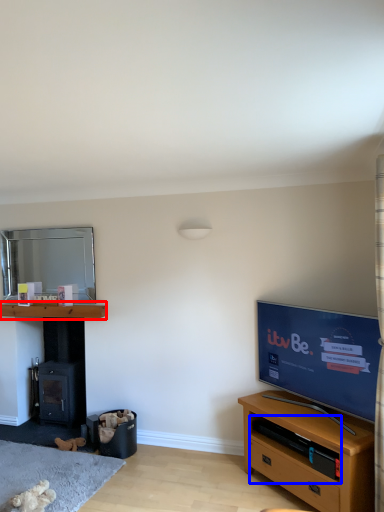
Question: Which point is further to the camera, shelf (highlighted by a red box) or shelf (highlighted by a blue box)?

Choices:
 (A) shelf
 (B) shelf

Answer: (A)